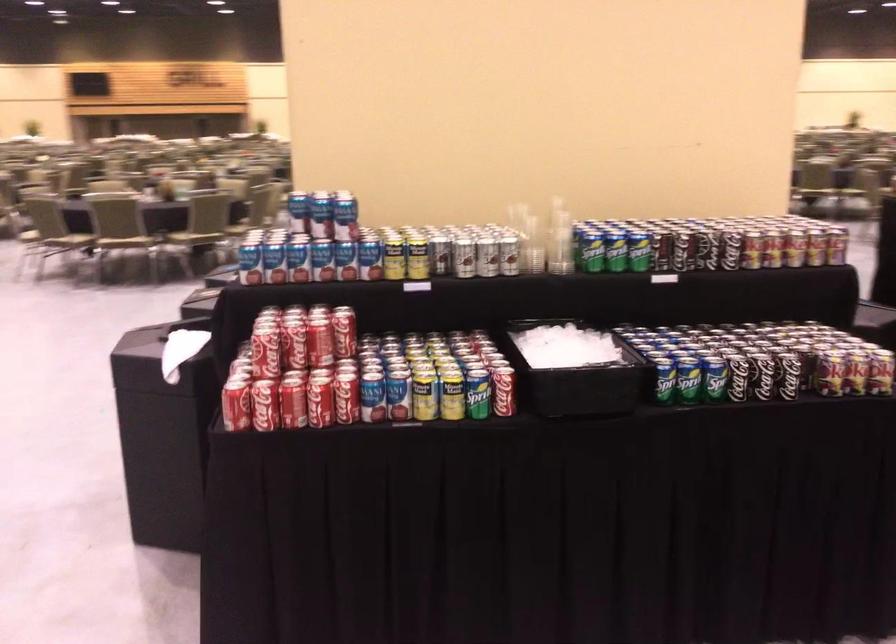
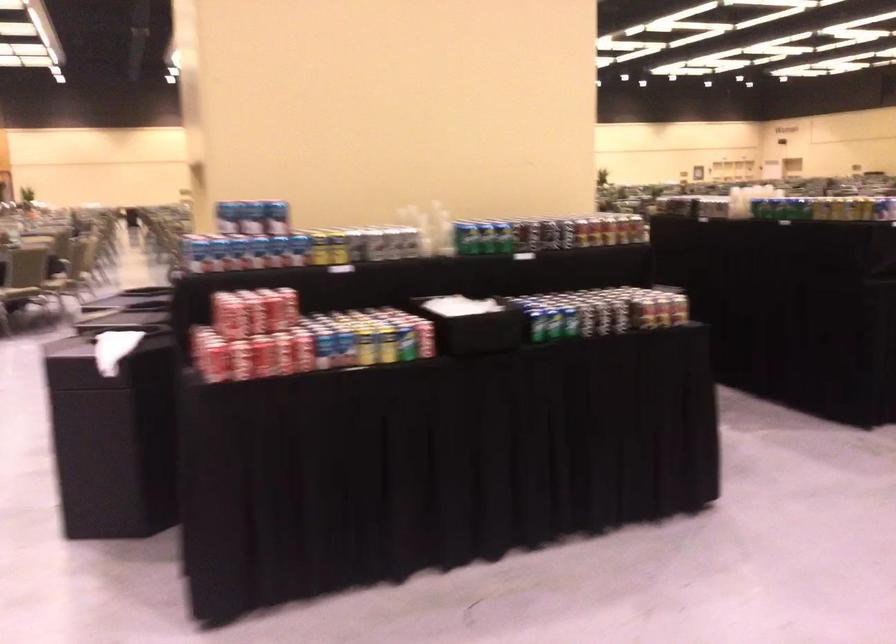
In the second image, find the point that corresponds to the point at 426,395 in the first image.

(365, 346)